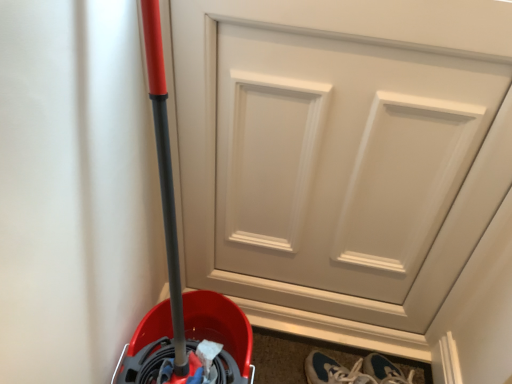
You are a GUI agent. You are given a task and a screenshot of the screen. Output one action in this format:
    pyautogui.click(x=<x>, y=<y>)
    Task: Click on the white matte door at center
    
    Given the screenshot: What is the action you would take?
    pyautogui.click(x=340, y=149)

This screenshot has width=512, height=384. What do you see at coordinates (340, 149) in the screenshot?
I see `white matte door at center` at bounding box center [340, 149].

What do you see at coordinates (333, 371) in the screenshot? The image size is (512, 384). I see `blue suede sneakers at lower right` at bounding box center [333, 371].

Locate an element on the screen. This screenshot has height=384, width=512. blue suede sneakers at lower right is located at coordinates (333, 371).

The height and width of the screenshot is (384, 512). What are the coordinates of `white matte door at center` in the screenshot? It's located at (340, 149).

Between blue suede sneakers at lower right and white matte door at center, which one appears on the left side from the viewer's perspective?

white matte door at center is more to the left.

Is the depth of blue suede sneakers at lower right greater than that of white matte door at center?

Yes, blue suede sneakers at lower right is further from the viewer.

Between point (312, 383) and point (259, 288), which one is positioned in front?

Point (312, 383)

From the image's perspective, which one is positioned lower, blue suede sneakers at lower right or white matte door at center?

blue suede sneakers at lower right.

From a real-world perspective, is blue suede sneakers at lower right beneath white matte door at center?

Correct, in the physical world, blue suede sneakers at lower right is lower than white matte door at center.

Does blue suede sneakers at lower right have a greater width compared to white matte door at center?

Indeed, blue suede sneakers at lower right has a greater width compared to white matte door at center.

Between blue suede sneakers at lower right and white matte door at center, which one has more height?

white matte door at center is taller.

Does blue suede sneakers at lower right have a smaller size compared to white matte door at center?

Correct, blue suede sneakers at lower right occupies less space than white matte door at center.

Looking at this image, is blue suede sneakers at lower right inside the boundaries of white matte door at center, or outside?

blue suede sneakers at lower right is outside white matte door at center.

Can you see blue suede sneakers at lower right touching white matte door at center?

No, blue suede sneakers at lower right is not touching white matte door at center.

Is blue suede sneakers at lower right looking in the opposite direction of white matte door at center?

Yes, white matte door at center is at the back of blue suede sneakers at lower right.

I want to click on footwear located on the right of white matte door at center, so click(333, 371).

Between white matte door at center and blue suede sneakers at lower right, which one appears on the right side from the viewer's perspective?

From the viewer's perspective, blue suede sneakers at lower right appears more on the right side.

Does white matte door at center come in front of blue suede sneakers at lower right?

That is True.

Considering the positions of point (441, 303) and point (314, 379), is point (441, 303) closer or farther from the camera than point (314, 379)?

Point (441, 303) is farther from the camera than point (314, 379).

From the image's perspective, is white matte door at center above or below blue suede sneakers at lower right?

From the image's perspective, white matte door at center appears above blue suede sneakers at lower right.

From a real-world perspective, between white matte door at center and blue suede sneakers at lower right, who is vertically lower?

In real-world perspective, blue suede sneakers at lower right is lower.

Can you confirm if white matte door at center is thinner than blue suede sneakers at lower right?

Correct, the width of white matte door at center is less than that of blue suede sneakers at lower right.

Considering the sizes of objects white matte door at center and blue suede sneakers at lower right in the image provided, who is taller, white matte door at center or blue suede sneakers at lower right?

With more height is white matte door at center.

Is white matte door at center bigger or smaller than blue suede sneakers at lower right?

Clearly, white matte door at center is larger in size than blue suede sneakers at lower right.

Consider the image. Would you say white matte door at center is inside or outside blue suede sneakers at lower right?

white matte door at center is spatially situated outside blue suede sneakers at lower right.

Can you see white matte door at center touching blue suede sneakers at lower right?

white matte door at center and blue suede sneakers at lower right are clearly separated.

Is white matte door at center turned away from blue suede sneakers at lower right?

white matte door at center is not turned away from blue suede sneakers at lower right.

Where is `footwear beneath the white matte door at center (from a real-world perspective)`? The height and width of the screenshot is (384, 512). footwear beneath the white matte door at center (from a real-world perspective) is located at coordinates (333, 371).

Find the location of a particular element. door above the blue suede sneakers at lower right (from the image's perspective) is located at coordinates (340, 149).

There is a blue suede sneakers at lower right. At what (x,y) coordinates should I click in order to perform the action: click on door above it (from a real-world perspective). Please return your answer as a coordinate pair (x, y). Looking at the image, I should click on (340, 149).